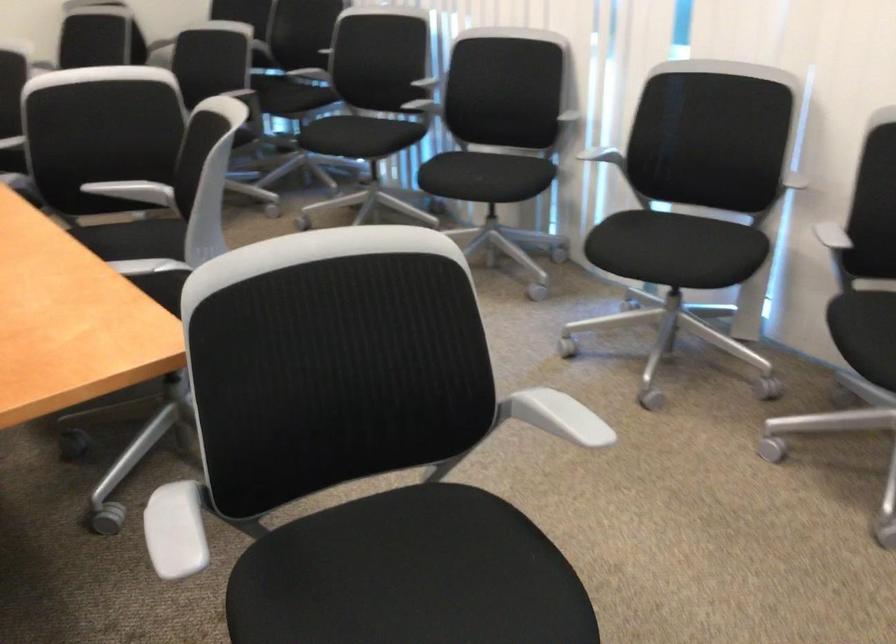
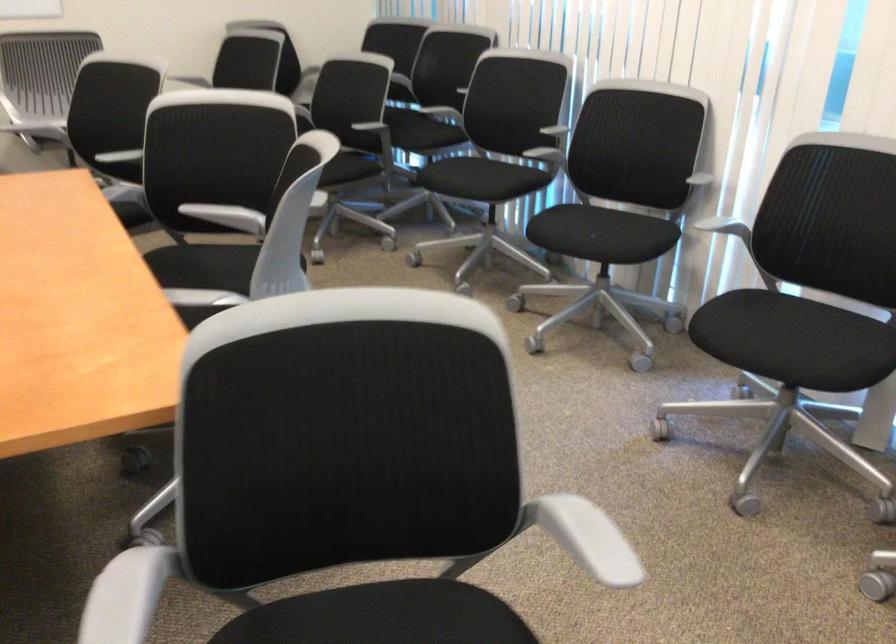
In a continuous first-person perspective shot, in which direction is the camera moving?

The movement direction of the cameraman is right, forward.